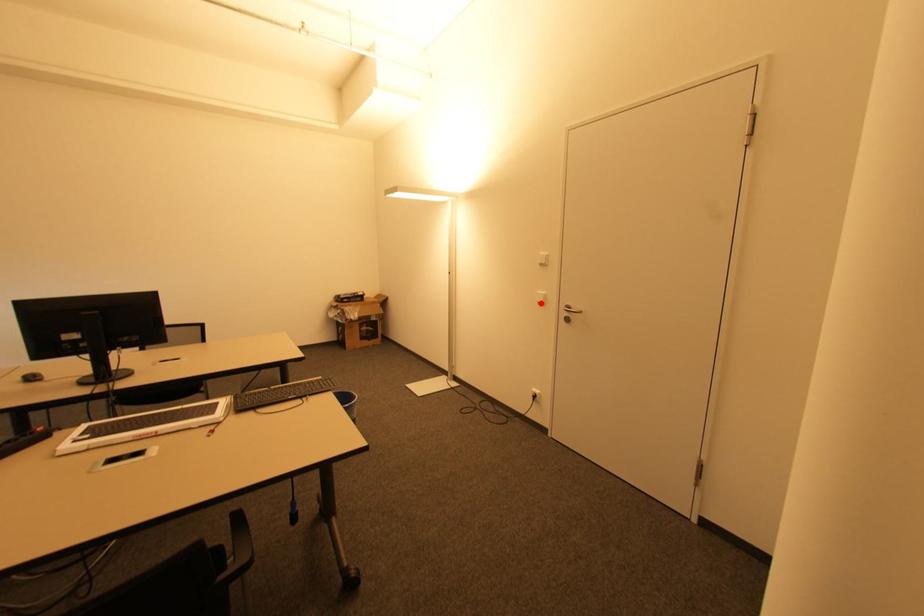
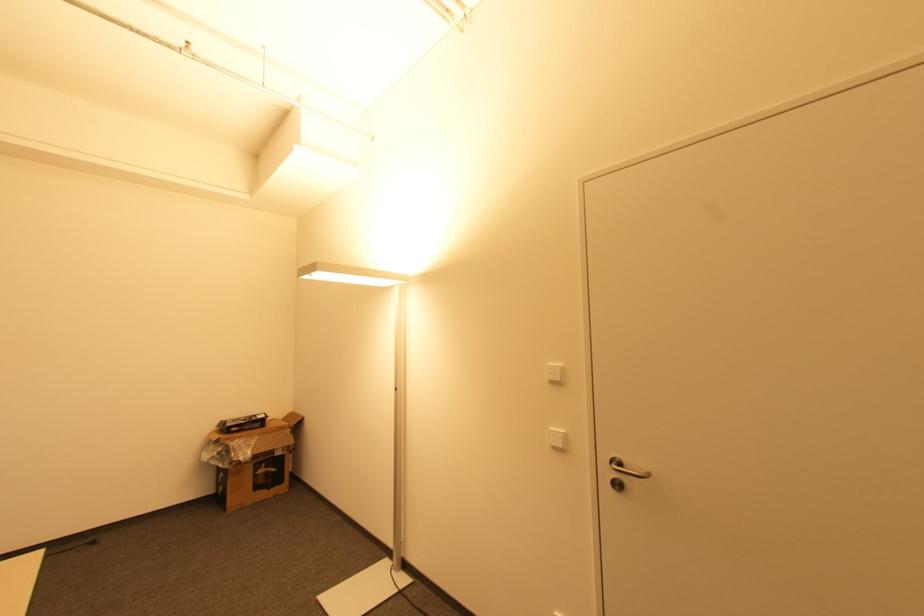
Locate, in the second image, the point that corresponds to the highlighted location in the first image.

(557, 448)